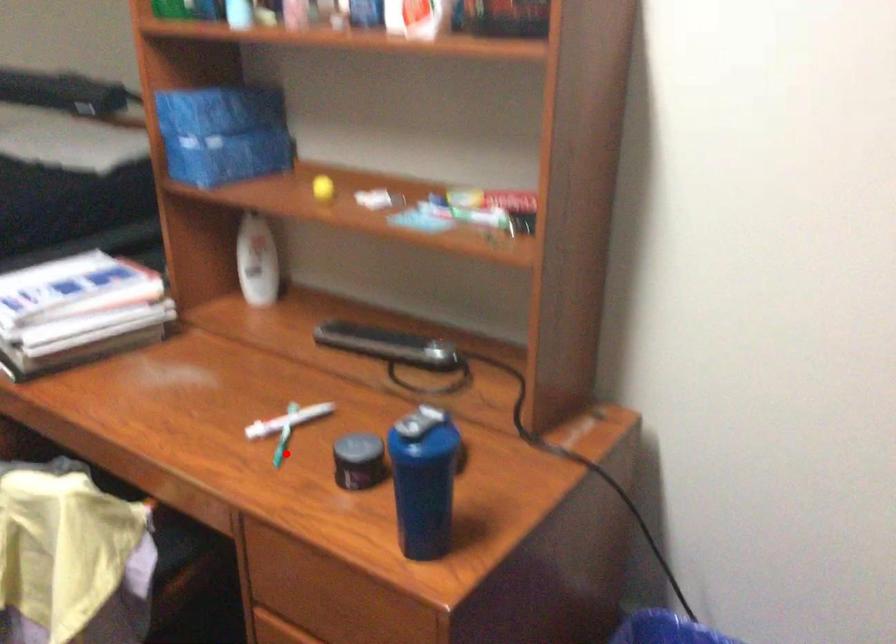
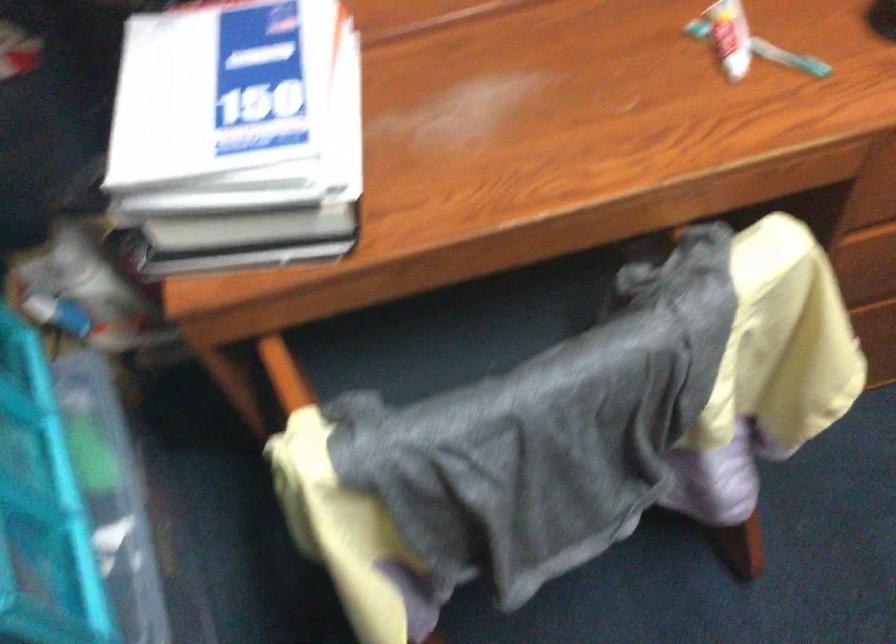
Question: I am providing you with two images of the same scene from different viewpoints. In image1, a red point is highlighted. Considering the same 3D point in image2, which of the following is correct?

Choices:
 (A) It is closer
 (B) It is farther

Answer: (A)